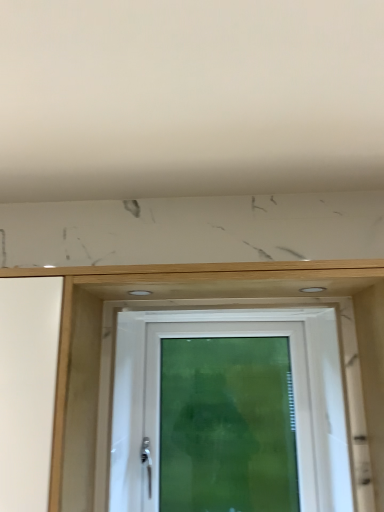
Identify the location of white glossy screen door at center. (129, 415).

The image size is (384, 512). Describe the element at coordinates (140, 293) in the screenshot. I see `white matte hole at upper center, which ranks as the first hole in left-to-right order` at that location.

Locate an element on the screen. The height and width of the screenshot is (512, 384). white matte hole at upper center, the 2th hole in the right-to-left sequence is located at coordinates (140, 293).

The height and width of the screenshot is (512, 384). Describe the element at coordinates (313, 289) in the screenshot. I see `matte white hole at upper center, arranged as the first hole when viewed from the right` at that location.

What do you see at coordinates (229, 412) in the screenshot?
I see `white plastic door at center` at bounding box center [229, 412].

This screenshot has width=384, height=512. I want to click on white glossy screen door at center, so click(129, 415).

Is white matte hole at upper center, which ranks as the first hole in left-to-right order, aimed at matte white hole at upper center, arranged as the first hole when viewed from the right?

No, white matte hole at upper center, which ranks as the first hole in left-to-right order, does not turn towards matte white hole at upper center, arranged as the first hole when viewed from the right.

Consider the image. Which object is further away from the camera, white matte hole at upper center, which ranks as the first hole in left-to-right order, or matte white hole at upper center, arranged as the first hole when viewed from the right?

Positioned behind is white matte hole at upper center, which ranks as the first hole in left-to-right order.

Are white matte hole at upper center, the 2th hole in the right-to-left sequence, and matte white hole at upper center, the second hole in the left-to-right sequence, located far from each other?

Actually, white matte hole at upper center, the 2th hole in the right-to-left sequence, and matte white hole at upper center, the second hole in the left-to-right sequence, are a little close together.

What's the angular difference between white matte hole at upper center, which ranks as the first hole in left-to-right order, and matte white hole at upper center, the second hole in the left-to-right sequence,'s facing directions?

The angle between the facing direction of white matte hole at upper center, which ranks as the first hole in left-to-right order, and the facing direction of matte white hole at upper center, the second hole in the left-to-right sequence, is 0.00297 degrees.

Is white plastic door at center at the back of white glossy screen door at center?

No, white glossy screen door at center is not facing the opposite direction of white plastic door at center.

Is white glossy screen door at center shorter than white plastic door at center?

Correct, white glossy screen door at center is not as tall as white plastic door at center.

Is white glossy screen door at center smaller than white plastic door at center?

Yes, white glossy screen door at center is smaller than white plastic door at center.

Is white glossy screen door at center at the right side of white plastic door at center?

Incorrect, white glossy screen door at center is not on the right side of white plastic door at center.

Does point (199, 396) come closer to viewer compared to point (138, 345)?

That is False.

Is white glossy screen door at center at the back of white plastic door at center?

white plastic door at center does not have its back to white glossy screen door at center.

Is white plastic door at center not inside white glossy screen door at center?

white plastic door at center lies outside white glossy screen door at center's area.

Between white plastic door at center and white glossy screen door at center, which one has less height?

Standing shorter between the two is white glossy screen door at center.

Would you say white plastic door at center is part of white matte hole at upper center, the 2th hole in the right-to-left sequence,'s contents?

No, white matte hole at upper center, the 2th hole in the right-to-left sequence, does not contain white plastic door at center.

Which hole is the 1st one when counting from the front of the white plastic door at center? Please provide its 2D coordinates.

[(140, 293)]

Is white matte hole at upper center, the 2th hole in the right-to-left sequence, positioned with its back to white plastic door at center?

No, white matte hole at upper center, the 2th hole in the right-to-left sequence, is not facing the opposite direction of white plastic door at center.

Could you measure the distance between white matte hole at upper center, which ranks as the first hole in left-to-right order, and white plastic door at center?

They are 20.25 inches apart.

Looking at this image, considering the sizes of objects matte white hole at upper center, the second hole in the left-to-right sequence, and white matte hole at upper center, which ranks as the first hole in left-to-right order, in the image provided, who is shorter, matte white hole at upper center, the second hole in the left-to-right sequence, or white matte hole at upper center, which ranks as the first hole in left-to-right order,?

matte white hole at upper center, the second hole in the left-to-right sequence, is shorter.

Is point (314, 291) farther from camera compared to point (147, 294)?

That is False.

Considering the relative sizes of matte white hole at upper center, the second hole in the left-to-right sequence, and white matte hole at upper center, which ranks as the first hole in left-to-right order, in the image provided, is matte white hole at upper center, the second hole in the left-to-right sequence, wider than white matte hole at upper center, which ranks as the first hole in left-to-right order,?

Yes, matte white hole at upper center, the second hole in the left-to-right sequence, is wider than white matte hole at upper center, which ranks as the first hole in left-to-right order.

The height and width of the screenshot is (512, 384). What are the coordinates of `hole located below the matte white hole at upper center, arranged as the first hole when viewed from the right (from the image's perspective)` in the screenshot? It's located at (140, 293).

Looking at their sizes, would you say white glossy screen door at center is wider or thinner than matte white hole at upper center, the second hole in the left-to-right sequence?

white glossy screen door at center is thinner than matte white hole at upper center, the second hole in the left-to-right sequence.

Is point (133, 392) positioned behind point (305, 288)?

Yes, point (133, 392) is farther from viewer.

Is white glossy screen door at center shorter than matte white hole at upper center, arranged as the first hole when viewed from the right?

In fact, white glossy screen door at center may be taller than matte white hole at upper center, arranged as the first hole when viewed from the right.

From a real-world perspective, is white glossy screen door at center physically below matte white hole at upper center, arranged as the first hole when viewed from the right?

Indeed, from a real-world perspective, white glossy screen door at center is positioned beneath matte white hole at upper center, arranged as the first hole when viewed from the right.

Is white glossy screen door at center aimed at white matte hole at upper center, the 2th hole in the right-to-left sequence?

No, white glossy screen door at center is not oriented towards white matte hole at upper center, the 2th hole in the right-to-left sequence.

Is white glossy screen door at center not close to white matte hole at upper center, the 2th hole in the right-to-left sequence?

No, white glossy screen door at center is not far away from white matte hole at upper center, the 2th hole in the right-to-left sequence.

Can you confirm if white glossy screen door at center is taller than white matte hole at upper center, which ranks as the first hole in left-to-right order?

Correct, white glossy screen door at center is much taller as white matte hole at upper center, which ranks as the first hole in left-to-right order.

From a real-world perspective, which object stands above the other?

In real-world perspective, white matte hole at upper center, which ranks as the first hole in left-to-right order, is above.

This screenshot has width=384, height=512. Identify the location of hole on the left of the matte white hole at upper center, the second hole in the left-to-right sequence. (140, 293).

This screenshot has height=512, width=384. In order to click on screen door that is above the white plastic door at center (from the image's perspective) in this screenshot , I will do `click(129, 415)`.

Considering their positions, is white plastic door at center positioned further to matte white hole at upper center, the second hole in the left-to-right sequence, than white glossy screen door at center?

white glossy screen door at center is further to matte white hole at upper center, the second hole in the left-to-right sequence.

From the image, which object appears to be farther from white matte hole at upper center, which ranks as the first hole in left-to-right order, matte white hole at upper center, the second hole in the left-to-right sequence, or white glossy screen door at center?

white glossy screen door at center lies further to white matte hole at upper center, which ranks as the first hole in left-to-right order, than the other object.

Based on their spatial positions, is white matte hole at upper center, the 2th hole in the right-to-left sequence, or matte white hole at upper center, the second hole in the left-to-right sequence, closer to white plastic door at center?

matte white hole at upper center, the second hole in the left-to-right sequence, is closer to white plastic door at center.

When comparing their distances from white plastic door at center, does matte white hole at upper center, arranged as the first hole when viewed from the right, or white glossy screen door at center seem further?

The object further to white plastic door at center is matte white hole at upper center, arranged as the first hole when viewed from the right.

Estimate the real-world distances between objects in this image. Which object is further from white plastic door at center, white glossy screen door at center or white matte hole at upper center, the 2th hole in the right-to-left sequence?

white matte hole at upper center, the 2th hole in the right-to-left sequence, lies further to white plastic door at center than the other object.

Which object lies further to the anchor point white matte hole at upper center, which ranks as the first hole in left-to-right order, white plastic door at center or white glossy screen door at center?

white plastic door at center.

Looking at the image, which one is located further to white glossy screen door at center, white plastic door at center or matte white hole at upper center, arranged as the first hole when viewed from the right?

Based on the image, matte white hole at upper center, arranged as the first hole when viewed from the right, appears to be further to white glossy screen door at center.

Considering their positions, is matte white hole at upper center, arranged as the first hole when viewed from the right, positioned closer to white glossy screen door at center than white plastic door at center?

white plastic door at center lies closer to white glossy screen door at center than the other object.

At what (x,y) coordinates should I click in order to perform the action: click on screen door between white matte hole at upper center, the 2th hole in the right-to-left sequence, and white plastic door at center, in the vertical direction. Please return your answer as a coordinate pair (x, y). The image size is (384, 512). Looking at the image, I should click on (129, 415).

Find the location of a particular element. Image resolution: width=384 pixels, height=512 pixels. door situated between white glossy screen door at center and matte white hole at upper center, the second hole in the left-to-right sequence, from left to right is located at coordinates (229, 412).

Find the location of a particular element. hole situated between white glossy screen door at center and matte white hole at upper center, arranged as the first hole when viewed from the right, from left to right is located at coordinates (140, 293).

The width and height of the screenshot is (384, 512). Identify the location of hole between matte white hole at upper center, the second hole in the left-to-right sequence, and white plastic door at center vertically. (140, 293).